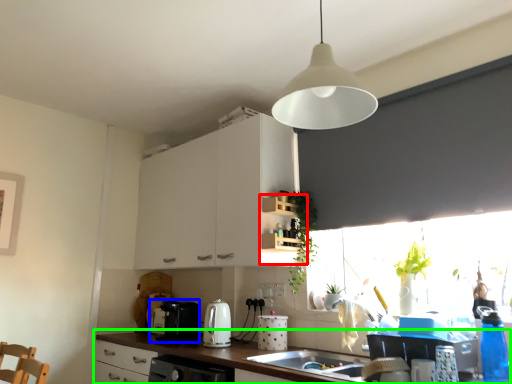
Question: Which object is positioned closest to shelf (highlighted by a red box)? Select from appliance (highlighted by a blue box) and countertop (highlighted by a green box).

Choices:
 (A) appliance
 (B) countertop

Answer: (B)